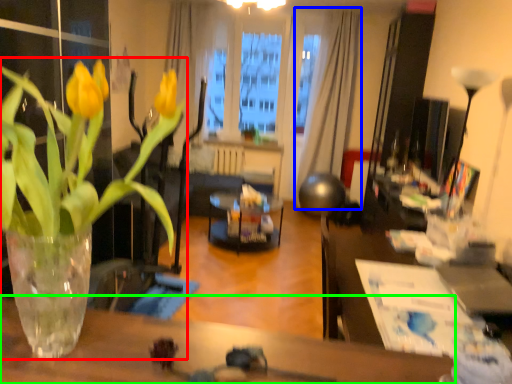
Question: Considering the real-world distances, which object is closest to houseplant (highlighted by a red box)? curtain (highlighted by a blue box) or table (highlighted by a green box).

Choices:
 (A) curtain
 (B) table

Answer: (B)